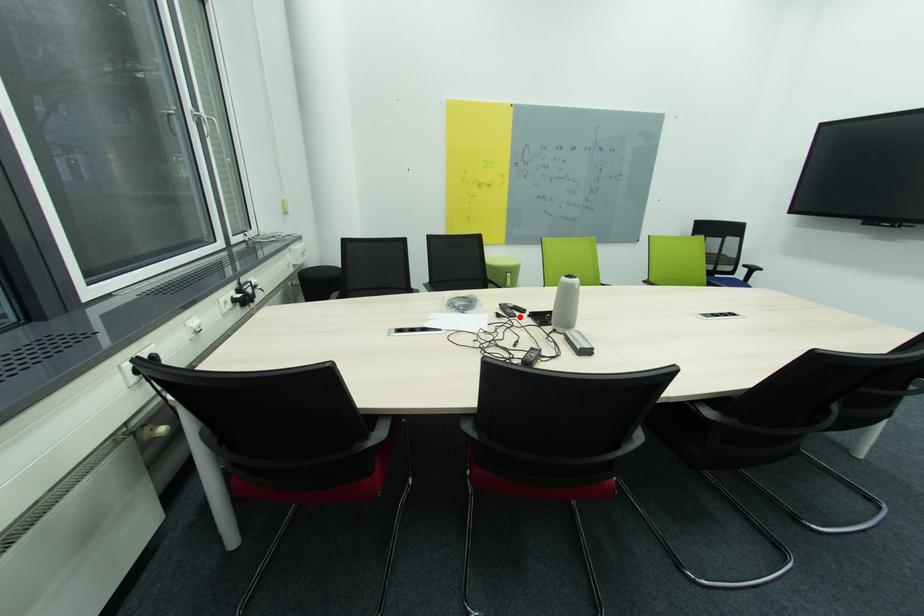
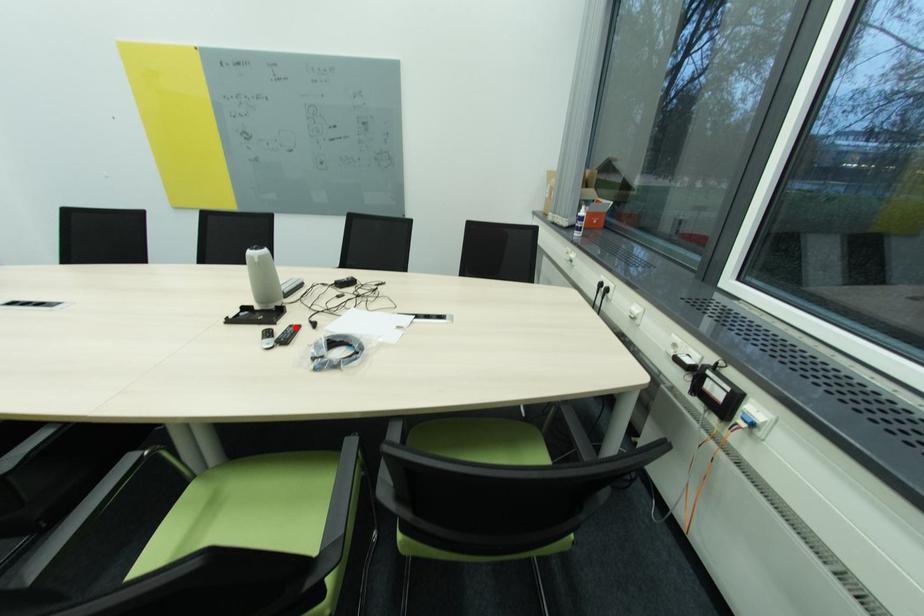
I am providing you with two images of the same scene from different viewpoints. A red point is marked on the first image and another point is marked on the second image. Is the red point in image1 aligned with the point shown in image2?

Yes